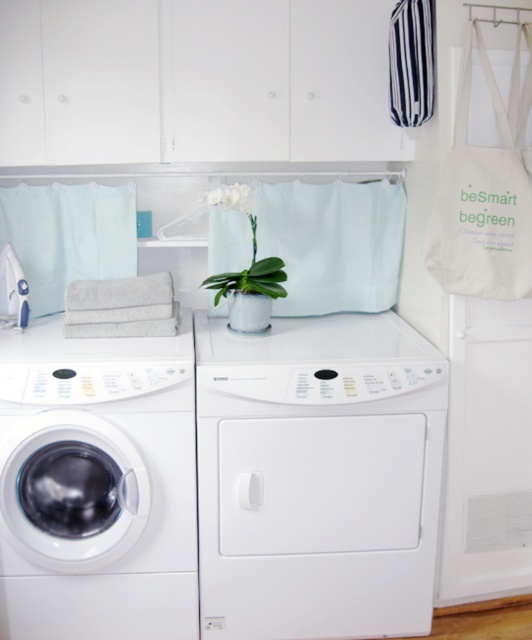
Is point (277, 493) more distant than point (280, 268)?

No, it is not.

Where is `white matte dryer at center`? white matte dryer at center is located at coordinates (318, 476).

Who is more forward, (x=146, y=422) or (x=147, y=284)?

Positioned in front is point (x=146, y=422).

Is point (55, 426) in front of point (153, 273)?

Yes, it is.

Where is `white glossy washing machine at left`? white glossy washing machine at left is located at coordinates (120, 474).

Which of these two, gray cotton towels at left or green matte orchid at center, stands taller?

green matte orchid at center is taller.

Is gray cotton towels at left positioned at the back of green matte orchid at center?

No, gray cotton towels at left is closer to the viewer.

Does point (117, 328) come behind point (269, 282)?

No, (117, 328) is closer to viewer.

Image resolution: width=532 pixels, height=640 pixels. I want to click on gray cotton towels at left, so click(120, 307).